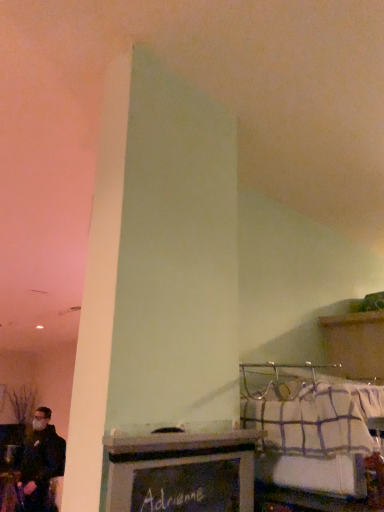
Question: From a real-world perspective, is white checkered fabric at lower right located beneath metallic silver tray at center?

Choices:
 (A) yes
 (B) no

Answer: (B)

Question: Considering the relative sizes of white checkered fabric at lower right and metallic silver tray at center in the image provided, is white checkered fabric at lower right taller than metallic silver tray at center?

Choices:
 (A) no
 (B) yes

Answer: (A)

Question: Is the depth of white checkered fabric at lower right greater than that of metallic silver tray at center?

Choices:
 (A) yes
 (B) no

Answer: (A)

Question: Are white checkered fabric at lower right and metallic silver tray at center beside each other?

Choices:
 (A) yes
 (B) no

Answer: (B)

Question: Is white checkered fabric at lower right to the right of metallic silver tray at center from the viewer's perspective?

Choices:
 (A) yes
 (B) no

Answer: (A)

Question: Is white checkered fabric at lower right located outside metallic silver tray at center?

Choices:
 (A) yes
 (B) no

Answer: (A)

Question: Is metallic silver tray at center far from white checkered fabric at lower right?

Choices:
 (A) yes
 (B) no

Answer: (B)

Question: Considering the relative sizes of metallic silver tray at center and white checkered fabric at lower right in the image provided, is metallic silver tray at center smaller than white checkered fabric at lower right?

Choices:
 (A) no
 (B) yes

Answer: (B)

Question: Considering the relative sizes of metallic silver tray at center and white checkered fabric at lower right in the image provided, is metallic silver tray at center wider than white checkered fabric at lower right?

Choices:
 (A) no
 (B) yes

Answer: (A)

Question: Could you tell me if metallic silver tray at center is facing white checkered fabric at lower right?

Choices:
 (A) no
 (B) yes

Answer: (A)

Question: Is metallic silver tray at center in front of white checkered fabric at lower right?

Choices:
 (A) yes
 (B) no

Answer: (A)

Question: Does metallic silver tray at center have a lesser height compared to white checkered fabric at lower right?

Choices:
 (A) yes
 (B) no

Answer: (B)

Question: From a real-world perspective, is white checkered fabric at lower right positioned above or below metallic silver tray at center?

Choices:
 (A) below
 (B) above

Answer: (B)